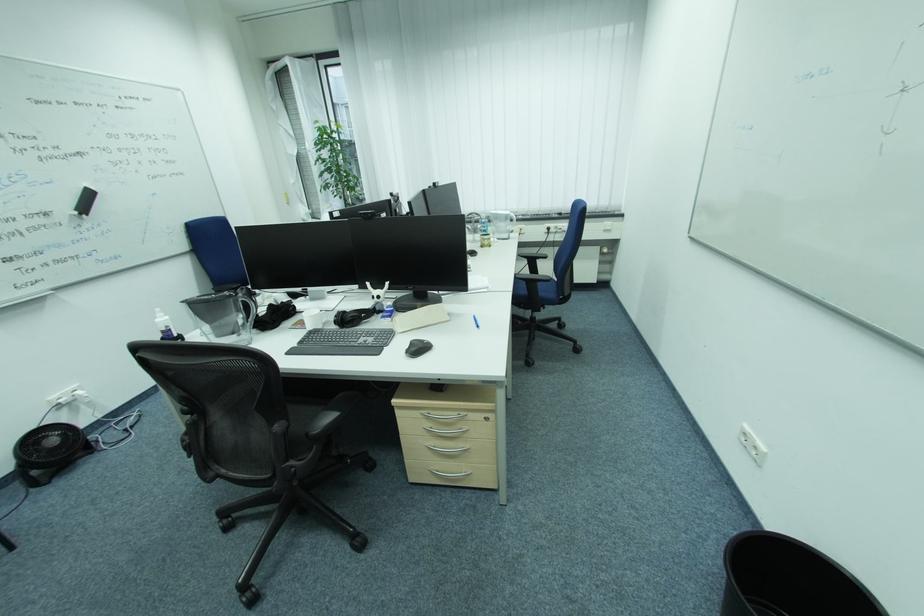
Find where to wear the black headphones. Please return your answer as a coordinate pair (x, y).

(357, 315)